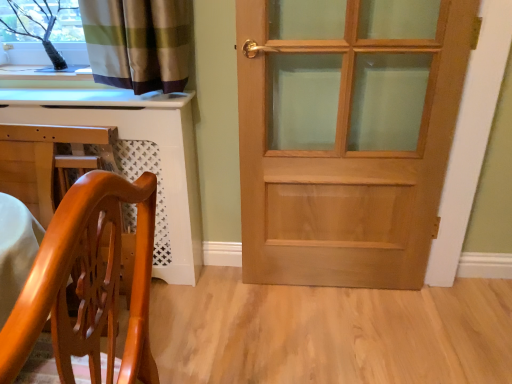
Question: Is light brown wooden door at center shorter than glossy wood chair at lower left?

Choices:
 (A) no
 (B) yes

Answer: (A)

Question: From the image's perspective, is light brown wooden door at center above glossy wood chair at lower left?

Choices:
 (A) yes
 (B) no

Answer: (A)

Question: Does light brown wooden door at center lie in front of glossy wood chair at lower left?

Choices:
 (A) no
 (B) yes

Answer: (A)

Question: Is light brown wooden door at center to the left of glossy wood chair at lower left from the viewer's perspective?

Choices:
 (A) yes
 (B) no

Answer: (B)

Question: Would you say glossy wood chair at lower left is part of light brown wooden door at center's contents?

Choices:
 (A) no
 (B) yes

Answer: (A)

Question: Would you say light brown wooden door at center is outside glossy wood chair at lower left?

Choices:
 (A) no
 (B) yes

Answer: (B)

Question: Is white glossy computer desk at lower left not near glossy wood chair at lower left?

Choices:
 (A) no
 (B) yes

Answer: (A)

Question: From a real-world perspective, is white glossy computer desk at lower left below glossy wood chair at lower left?

Choices:
 (A) yes
 (B) no

Answer: (A)

Question: Considering the relative sizes of white glossy computer desk at lower left and glossy wood chair at lower left in the image provided, is white glossy computer desk at lower left bigger than glossy wood chair at lower left?

Choices:
 (A) no
 (B) yes

Answer: (A)

Question: Is glossy wood chair at lower left at the back of white glossy computer desk at lower left?

Choices:
 (A) no
 (B) yes

Answer: (A)

Question: Is white glossy computer desk at lower left to the left of glossy wood chair at lower left from the viewer's perspective?

Choices:
 (A) no
 (B) yes

Answer: (B)

Question: Considering the relative positions of white glossy computer desk at lower left and glossy wood chair at lower left in the image provided, is white glossy computer desk at lower left behind glossy wood chair at lower left?

Choices:
 (A) yes
 (B) no

Answer: (A)

Question: Does light brown wooden door at center appear on the left side of white glossy computer desk at lower left?

Choices:
 (A) yes
 (B) no

Answer: (B)